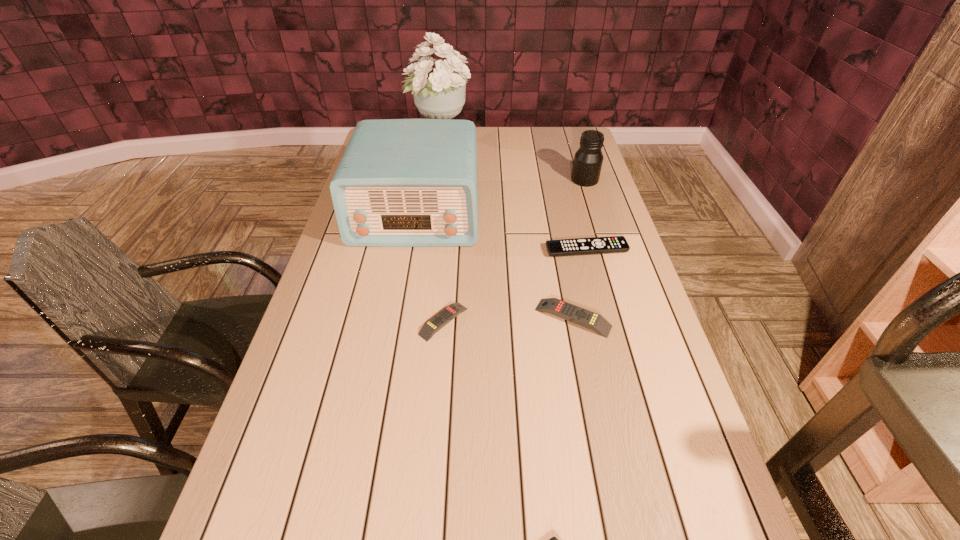
Where is `free space at the far edge`? free space at the far edge is located at coordinates (480, 148).

Where is `vacant area at the right edge`? vacant area at the right edge is located at coordinates (639, 481).

At what (x,y) coordinates should I click in order to perform the action: click on free region at the far right corner of the desktop. Please return your answer as a coordinate pair (x, y). The image size is (960, 540). Looking at the image, I should click on (563, 144).

Where is `unoccupied area between the farthest object and the farthest remote control`? unoccupied area between the farthest object and the farthest remote control is located at coordinates (513, 197).

Identify which object is located as the fourth nearest to the radio receiver. Please provide its 2D coordinates. Your answer should be formatted as a tuple, i.e. [(x, y)], where the tuple contains the x and y coordinates of a point satisfying the conditions above.

[(583, 317)]

Choose which object is the second nearest neighbor to the farther black remote control. Please provide its 2D coordinates. Your answer should be formatted as a tuple, i.e. [(x, y)], where the tuple contains the x and y coordinates of a point satisfying the conditions above.

[(401, 182)]

Select which remote control appears as the second closest to the jar. Please provide its 2D coordinates. Your answer should be formatted as a tuple, i.e. [(x, y)], where the tuple contains the x and y coordinates of a point satisfying the conditions above.

[(583, 317)]

Where is `remote control that is the nearest to the farthest remote control`? The width and height of the screenshot is (960, 540). remote control that is the nearest to the farthest remote control is located at coordinates 583,317.

Select which black remote control is the closest to the farthest object. Please provide its 2D coordinates. Your answer should be formatted as a tuple, i.e. [(x, y)], where the tuple contains the x and y coordinates of a point satisfying the conditions above.

[(613, 244)]

I want to click on blank space that satisfies the following two spatial constraints: 1. on the front side of the fifth shortest object; 2. on the left side of the tallest object, so click(435, 180).